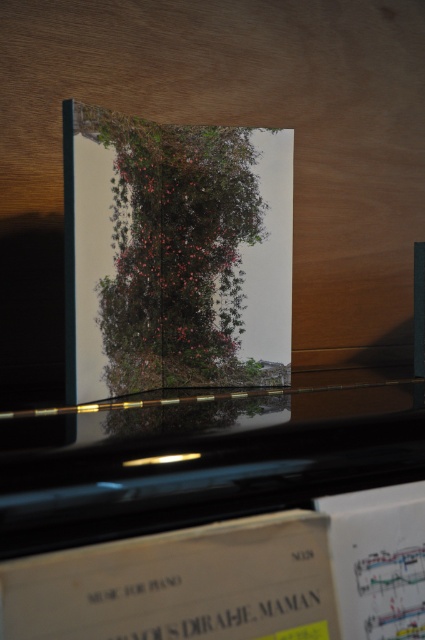
Is white paper music at lower center further to camera compared to white paper music at lower right?

No, white paper music at lower center is in front of white paper music at lower right.

Is white paper music at lower center bigger than white paper music at lower right?

Yes.

Where is `white paper music at lower center`? The image size is (425, 640). white paper music at lower center is located at coordinates (181, 584).

Is black glossy piano at upper center positioned in front of white paper music at lower right?

That is True.

Can you confirm if black glossy piano at upper center is positioned below white paper music at lower right?

Incorrect, black glossy piano at upper center is not positioned below white paper music at lower right.

Between point (45, 472) and point (354, 557), which one is positioned behind?

Point (354, 557)

The width and height of the screenshot is (425, 640). In order to click on black glossy piano at upper center in this screenshot , I will do tap(218, 518).

Can you confirm if black glossy piano at upper center is thinner than green leafy plant at center?

In fact, black glossy piano at upper center might be wider than green leafy plant at center.

Between black glossy piano at upper center and green leafy plant at center, which one has less height?

black glossy piano at upper center is shorter.

Who is more forward, (x=249, y=410) or (x=107, y=324)?

Point (x=249, y=410) is in front.

Where is `black glossy piano at upper center`? black glossy piano at upper center is located at coordinates (218, 518).